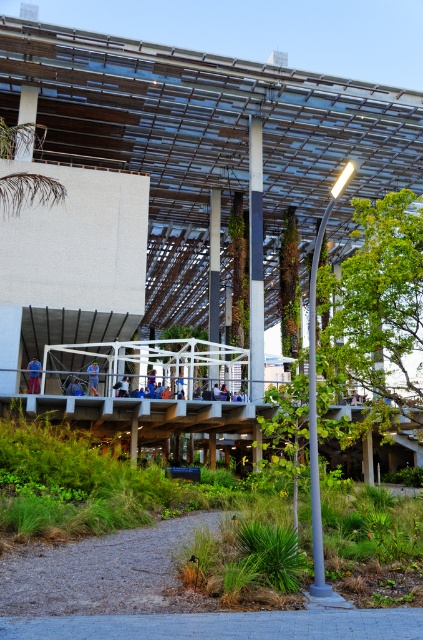
Question: In this image, where is gray concrete path at lower center located relative to blue fabric person at center?

Choices:
 (A) right
 (B) left

Answer: (A)

Question: Which point is farther to the camera?

Choices:
 (A) green leafy tree at center
 (B) blue denim jeans at lower left

Answer: (B)

Question: Estimate the real-world distances between objects in this image. Which object is farther from the gray concrete path at lower center?

Choices:
 (A) green leafy tree at center
 (B) blue fabric person at center

Answer: (B)

Question: Is green leafy tree at center smaller than blue fabric person at center?

Choices:
 (A) no
 (B) yes

Answer: (A)

Question: From the image, what is the correct spatial relationship of green leafy tree at center in relation to blue fabric person at center?

Choices:
 (A) below
 (B) above

Answer: (B)

Question: Considering the real-world distances, which object is farthest from the green leafy tree at center?

Choices:
 (A) blue fabric person at center
 (B) gray concrete path at lower center

Answer: (A)